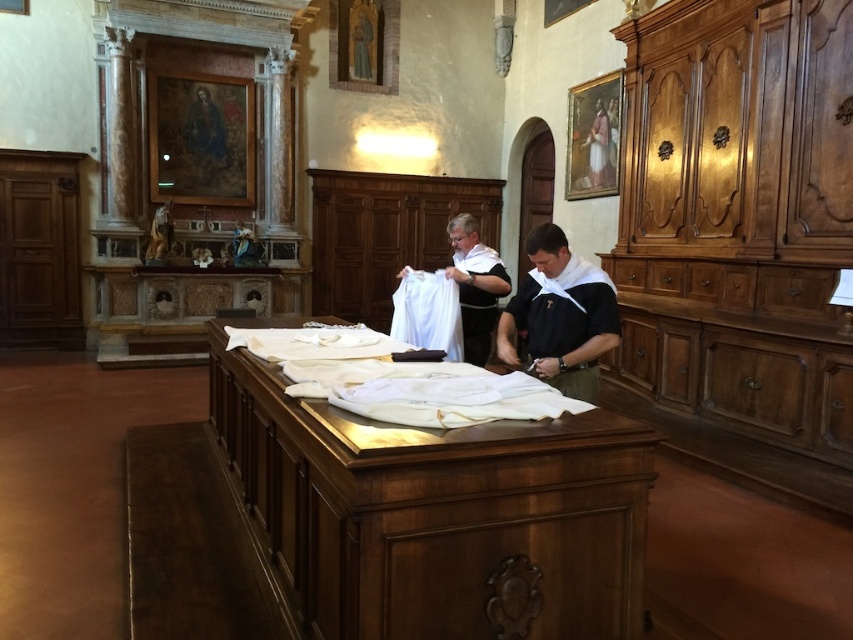
Question: Which object is closer to the camera taking this photo?

Choices:
 (A) wooden table at center
 (B) white cloth at center
 (C) black cotton shirt at center

Answer: (A)

Question: Which point appears closest to the camera in this image?

Choices:
 (A) (312, 557)
 (B) (575, 301)

Answer: (A)

Question: Does wooden table at center appear on the left side of white cloth at center?

Choices:
 (A) yes
 (B) no

Answer: (A)

Question: Can you confirm if black cotton shirt at center is smaller than white cloth at center?

Choices:
 (A) no
 (B) yes

Answer: (B)

Question: Which point is farther from the camera taking this photo?

Choices:
 (A) (485, 547)
 (B) (538, 273)
 (C) (473, 240)

Answer: (C)

Question: Is wooden table at center positioned behind black cotton shirt at center?

Choices:
 (A) no
 (B) yes

Answer: (A)